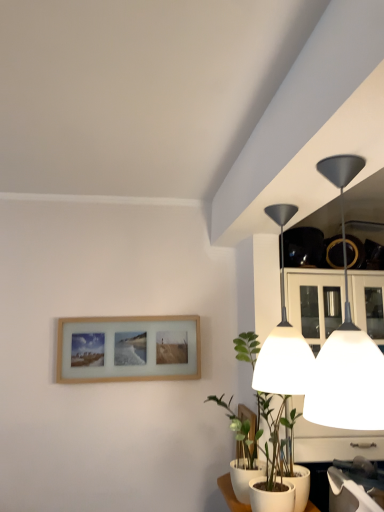
Question: Can you confirm if wooden picture frame at lower center, the second picture frame positioned from the top, is positioned to the right of matte black lampshade at upper right, which is the 2th lamp in back-to-front order?

Choices:
 (A) yes
 (B) no

Answer: (B)

Question: Is wooden picture frame at lower center, acting as the first picture frame starting from the front, positioned behind matte black lampshade at upper right, which is the 1th lamp from front to back?

Choices:
 (A) yes
 (B) no

Answer: (A)

Question: Considering the relative sizes of wooden picture frame at lower center, which appears as the second picture frame when viewed from the left, and matte black lampshade at upper right, which is the 1th lamp from front to back, in the image provided, is wooden picture frame at lower center, which appears as the second picture frame when viewed from the left, smaller than matte black lampshade at upper right, which is the 1th lamp from front to back,?

Choices:
 (A) yes
 (B) no

Answer: (A)

Question: Is wooden picture frame at lower center, the second picture frame positioned from the top, positioned in front of matte black lampshade at upper right, which is the 2th lamp in back-to-front order?

Choices:
 (A) no
 (B) yes

Answer: (A)

Question: Is wooden picture frame at lower center, the second picture frame from the back, thinner than matte black lampshade at upper right, which is the 1th lamp from front to back?

Choices:
 (A) no
 (B) yes

Answer: (B)

Question: Would you say wooden picture frame at lower center, placed as the first picture frame when sorted from right to left, is to the left or to the right of matte black lampshade at upper right, which is the 2th lamp in back-to-front order, in the picture?

Choices:
 (A) left
 (B) right

Answer: (A)

Question: Considering the positions of point (244, 416) and point (312, 391), is point (244, 416) closer or farther from the camera than point (312, 391)?

Choices:
 (A) closer
 (B) farther

Answer: (B)

Question: Considering the positions of wooden picture frame at lower center, placed as the 1th picture frame when sorted from bottom to top, and matte black lampshade at upper right, which is the 2th lamp in back-to-front order, in the image, is wooden picture frame at lower center, placed as the 1th picture frame when sorted from bottom to top, bigger or smaller than matte black lampshade at upper right, which is the 2th lamp in back-to-front order,?

Choices:
 (A) big
 (B) small

Answer: (B)

Question: From the image's perspective, is wooden picture frame at lower center, acting as the first picture frame starting from the front, positioned above or below matte black lampshade at upper right, which is the 2th lamp in back-to-front order?

Choices:
 (A) below
 (B) above

Answer: (A)

Question: Relative to wooden picture frame at lower left, the 2th picture frame when ordered from front to back, is green matte plant at lower right in front or behind?

Choices:
 (A) front
 (B) behind

Answer: (A)

Question: In the image, is green matte plant at lower right on the left side or the right side of wooden picture frame at lower left, the 1th picture frame positioned from the top?

Choices:
 (A) left
 (B) right

Answer: (B)

Question: From a real-world perspective, is green matte plant at lower right positioned above or below wooden picture frame at lower left, the first picture frame in the left-to-right sequence?

Choices:
 (A) above
 (B) below

Answer: (B)

Question: In terms of height, does green matte plant at lower right look taller or shorter compared to wooden picture frame at lower left, the 2th picture frame when ordered from front to back?

Choices:
 (A) short
 (B) tall

Answer: (B)

Question: From a real-world perspective, is white matte lampshade at upper right, which is the second lamp from front to back, above or below matte black lampshade at upper right, which is the 1th lamp from front to back?

Choices:
 (A) above
 (B) below

Answer: (A)

Question: Considering the relative positions of white matte lampshade at upper right, the first lamp when ordered from back to front, and matte black lampshade at upper right, which is the 1th lamp from front to back, in the image provided, is white matte lampshade at upper right, the first lamp when ordered from back to front, to the left or to the right of matte black lampshade at upper right, which is the 1th lamp from front to back,?

Choices:
 (A) left
 (B) right

Answer: (A)